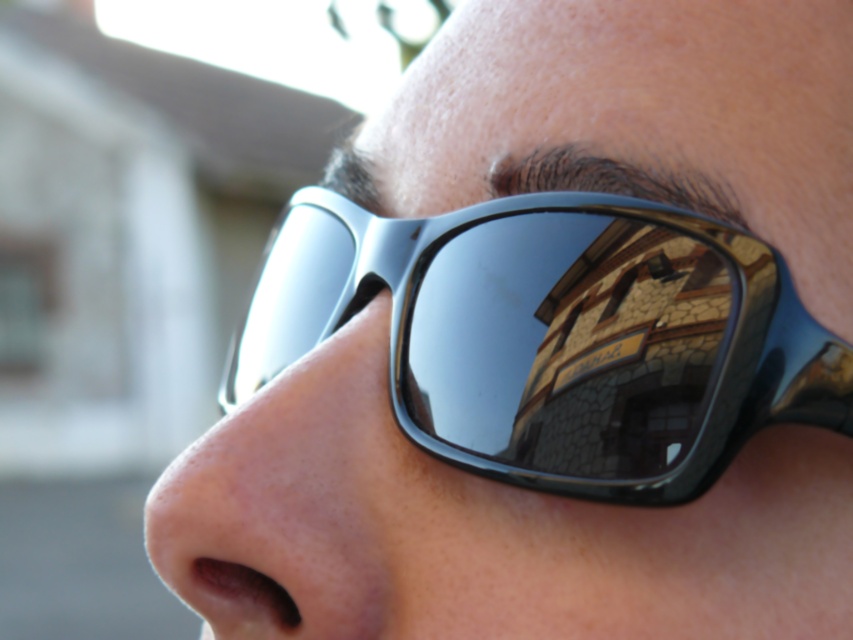
You are a photographer adjusting your camera settings to capture the reflection in the black shiny sunglasses at center and the matte skin nose at lower left. Based on their positions, which object is closer to the right side of the frame?

The black shiny sunglasses at center are to the right of the matte skin nose at lower left, so the black shiny sunglasses at center is closer to the right side of the frame.

You are a photographer trying to capture the reflection of the building in the black shiny sunglasses at center. Since the matte skin nose at lower left might obstruct the reflection, can you adjust your position to avoid it?

The black shiny sunglasses at center is above the matte skin nose at lower left. By positioning yourself below the sunglasses, you can avoid the nose obstruction and capture the reflection clearly.